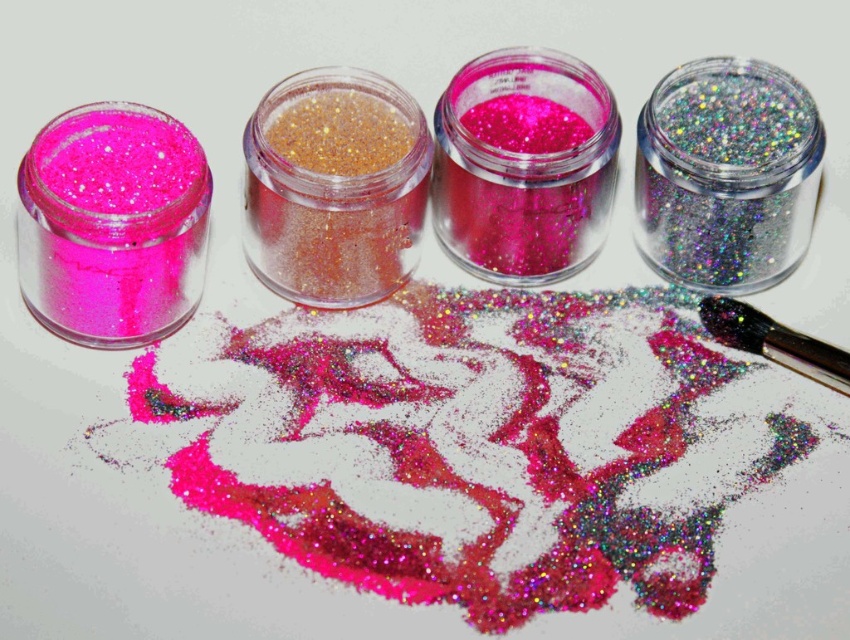
You are an artist working on a craft project. You have a gold glitter powder at center and a metallic silver brush at upper right. Which object is closer to the left edge of your workspace?

The gold glitter powder at center is closer to the left edge of the workspace because it is positioned to the left of the metallic silver brush at upper right.

You are standing in front of a row of four jars filled with glitter. You notice two points marked on the jars. The first point is at coordinates point (364, 108) and the second is at point (803, 355). Which of these two points is closer to you?

Point (364, 108) is closer to you because it is further to the viewer than point (803, 355).